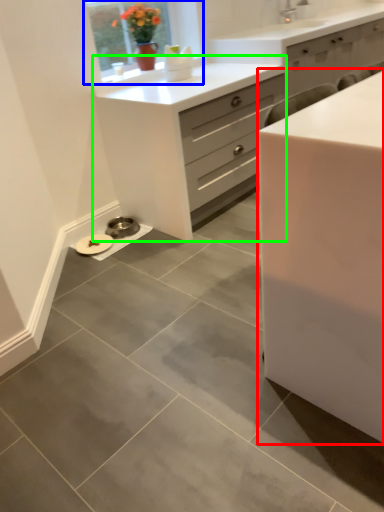
Question: Considering the real-world distances, which object is farthest from chest of drawers (highlighted by a red box)? window (highlighted by a blue box) or chest of drawers (highlighted by a green box)?

Choices:
 (A) window
 (B) chest of drawers

Answer: (A)